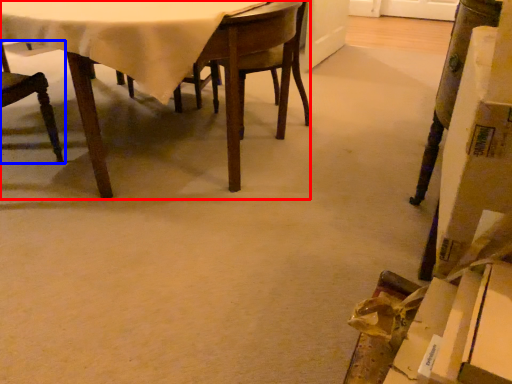
Question: Which of the following is the farthest to the observer, table (highlighted by a red box) or chair (highlighted by a blue box)?

Choices:
 (A) table
 (B) chair

Answer: (B)